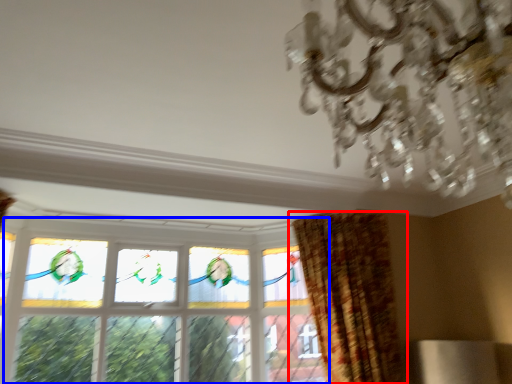
Question: Which point is closer to the camera, curtain (highlighted by a red box) or window (highlighted by a blue box)?

Choices:
 (A) curtain
 (B) window

Answer: (A)